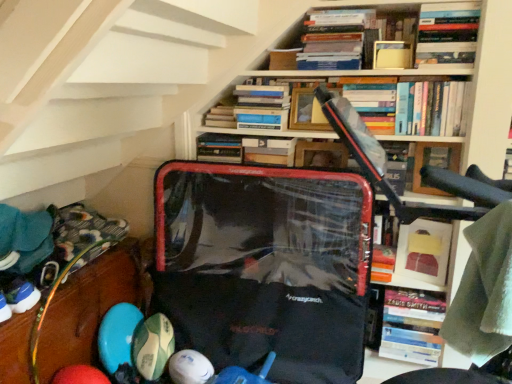
Question: Is matte yellow book at upper center, which is the third book from top to bottom, further to the viewer compared to green rubber ball at lower left, arranged as the second toy when viewed from the right?

Choices:
 (A) yes
 (B) no

Answer: (B)

Question: From the image's perspective, does matte yellow book at upper center, acting as the 5th book starting from the bottom, appear higher than green rubber ball at lower left, positioned as the first toy in left-to-right order?

Choices:
 (A) no
 (B) yes

Answer: (B)

Question: From a real-world perspective, is matte yellow book at upper center, which is the third book from top to bottom, positioned under green rubber ball at lower left, positioned as the first toy in left-to-right order, based on gravity?

Choices:
 (A) yes
 (B) no

Answer: (B)

Question: Considering the relative sizes of matte yellow book at upper center, which is the third book from top to bottom, and green rubber ball at lower left, positioned as the first toy in left-to-right order, in the image provided, is matte yellow book at upper center, which is the third book from top to bottom, shorter than green rubber ball at lower left, positioned as the first toy in left-to-right order,?

Choices:
 (A) yes
 (B) no

Answer: (A)

Question: Considering the relative positions of matte yellow book at upper center, acting as the 5th book starting from the bottom, and green rubber ball at lower left, positioned as the first toy in left-to-right order, in the image provided, is matte yellow book at upper center, acting as the 5th book starting from the bottom, to the right of green rubber ball at lower left, positioned as the first toy in left-to-right order, from the viewer's perspective?

Choices:
 (A) yes
 (B) no

Answer: (A)

Question: From the image's perspective, is hardcover book at center, which is the 1th book from bottom to top, positioned above or below white rubber ball at lower center, which is the second toy in left-to-right order?

Choices:
 (A) below
 (B) above

Answer: (B)

Question: Does point (415, 304) appear closer or farther from the camera than point (201, 362)?

Choices:
 (A) farther
 (B) closer

Answer: (B)

Question: In terms of width, does hardcover book at center, which is the 1th book from bottom to top, look wider or thinner when compared to white rubber ball at lower center, positioned as the 1th toy in right-to-left order?

Choices:
 (A) wide
 (B) thin

Answer: (A)

Question: In the image, is hardcover book at center, which is the 1th book from bottom to top, positioned in front of or behind white rubber ball at lower center, positioned as the 1th toy in right-to-left order?

Choices:
 (A) front
 (B) behind

Answer: (B)

Question: In terms of width, does hardcover book at upper center, the 4th book in the top-to-bottom sequence, look wider or thinner when compared to rubberized plastic balls at lower left, positioned as the second shelf in right-to-left order?

Choices:
 (A) wide
 (B) thin

Answer: (B)

Question: Is point (281, 92) positioned closer to the camera than point (15, 342)?

Choices:
 (A) farther
 (B) closer

Answer: (A)

Question: From a real-world perspective, is hardcover book at upper center, which is the 4th book from bottom to top, physically located above or below rubberized plastic balls at lower left, positioned as the second shelf in right-to-left order?

Choices:
 (A) above
 (B) below

Answer: (A)

Question: Is hardcover book at upper center, the 4th book in the top-to-bottom sequence, inside the boundaries of rubberized plastic balls at lower left, which ranks as the 1th shelf in left-to-right order, or outside?

Choices:
 (A) inside
 (B) outside

Answer: (B)

Question: Is matte yellow book at upper center, acting as the 5th book starting from the bottom, in front of or behind hardcover book at upper right, arranged as the 2th book when viewed from the top, in the image?

Choices:
 (A) front
 (B) behind

Answer: (B)

Question: From a real-world perspective, is matte yellow book at upper center, which is the third book from top to bottom, physically located above or below hardcover book at upper right, arranged as the 2th book when viewed from the top?

Choices:
 (A) below
 (B) above

Answer: (A)